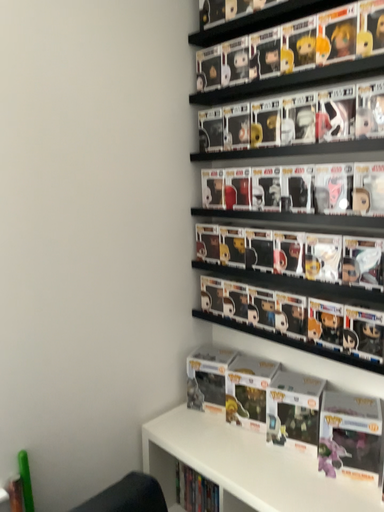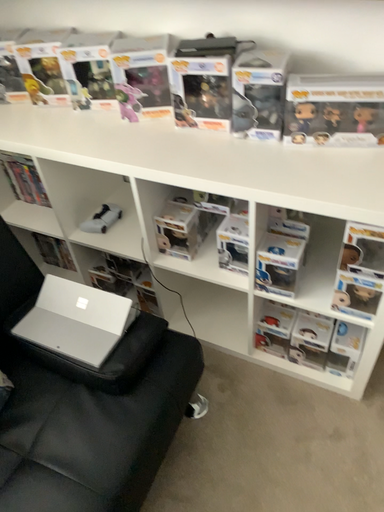
Question: How did the camera likely rotate when shooting the video?

Choices:
 (A) rotated left
 (B) rotated right

Answer: (B)